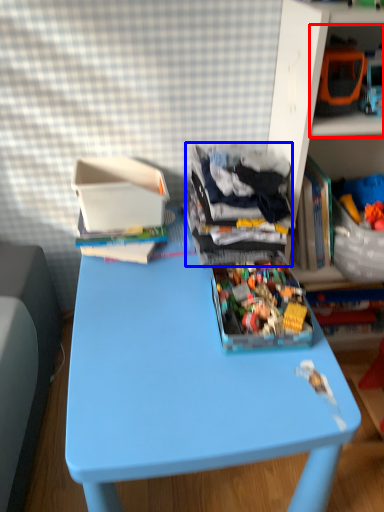
Question: Which object is further to the camera taking this photo, shelf (highlighted by a red box) or clothing (highlighted by a blue box)?

Choices:
 (A) shelf
 (B) clothing

Answer: (B)